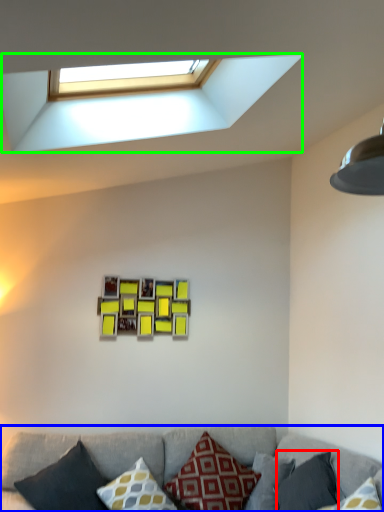
Question: Which is farther away from pillow (highlighted by a red box)? studio couch (highlighted by a blue box) or window (highlighted by a green box)?

Choices:
 (A) studio couch
 (B) window

Answer: (B)